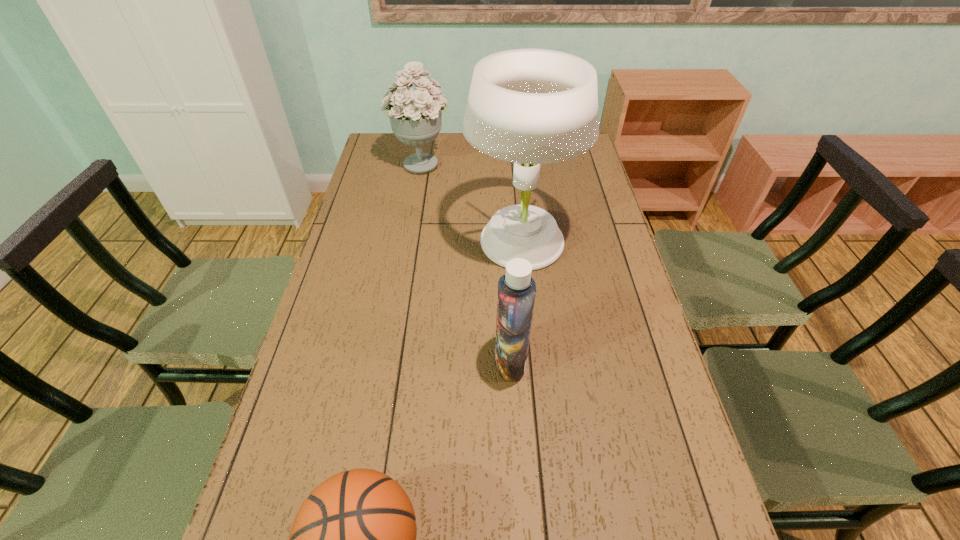
This screenshot has height=540, width=960. In order to click on the third nearest object in this screenshot , I will do `click(529, 106)`.

The image size is (960, 540). Find the location of `lamp`. lamp is located at coordinates (529, 106).

Identify the location of the farthest object. This screenshot has height=540, width=960. (415, 116).

Locate an element on the screen. The width and height of the screenshot is (960, 540). shampoo is located at coordinates (516, 289).

What are the coordinates of `the second nearest object` in the screenshot? It's located at (x=516, y=289).

Locate an element on the screen. blank space located 0.120m on the front-facing side of the lamp is located at coordinates (429, 241).

Where is `blank space located on the front-facing side of the lamp`? The height and width of the screenshot is (540, 960). blank space located on the front-facing side of the lamp is located at coordinates (343, 241).

Identify the location of vacant area situated 0.390m on the front-facing side of the lamp. Image resolution: width=960 pixels, height=540 pixels. (347, 241).

Where is `vacant space located 0.050m on the back of the bouquet`? Image resolution: width=960 pixels, height=540 pixels. vacant space located 0.050m on the back of the bouquet is located at coordinates (424, 142).

This screenshot has height=540, width=960. What are the coordinates of `free region located 0.150m on the front label of the shampoo` in the screenshot? It's located at (436, 361).